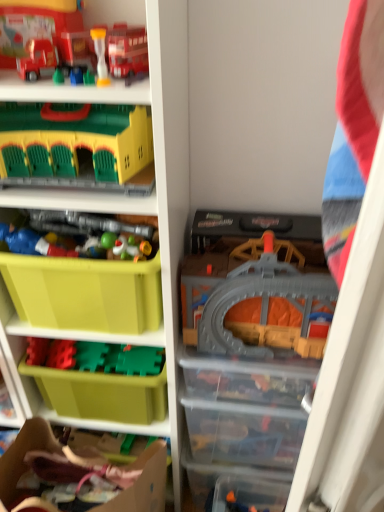
Question: Considering the relative sizes of matte plastic toy at left, placed as the 5th toy when sorted from top to bottom, and plastic toy soldiers at center, the fourth toy ordered from the bottom, in the image provided, is matte plastic toy at left, placed as the 5th toy when sorted from top to bottom, thinner than plastic toy soldiers at center, the fourth toy ordered from the bottom,?

Choices:
 (A) yes
 (B) no

Answer: (A)

Question: Is matte plastic toy at left, placed as the 5th toy when sorted from top to bottom, to the right of plastic toy soldiers at center, the fourth toy ordered from the bottom, from the viewer's perspective?

Choices:
 (A) yes
 (B) no

Answer: (B)

Question: Are matte plastic toy at left, the third toy ordered from the bottom, and plastic toy soldiers at center, the fourth toy ordered from the bottom, located far from each other?

Choices:
 (A) no
 (B) yes

Answer: (A)

Question: Is matte plastic toy at left, placed as the 5th toy when sorted from top to bottom, looking in the opposite direction of plastic toy soldiers at center, acting as the fourth toy starting from the top?

Choices:
 (A) no
 (B) yes

Answer: (B)

Question: Could you tell me if matte plastic toy at left, the third toy ordered from the bottom, is turned towards plastic toy soldiers at center, the fourth toy ordered from the bottom?

Choices:
 (A) yes
 (B) no

Answer: (B)

Question: Can you confirm if matte plastic toy at left, the third toy ordered from the bottom, is smaller than plastic toy soldiers at center, acting as the fourth toy starting from the top?

Choices:
 (A) yes
 (B) no

Answer: (A)

Question: Is matte plastic shelf at center not within green plastic building block at upper left, the fifth toy in the bottom-to-top sequence?

Choices:
 (A) yes
 (B) no

Answer: (A)

Question: Is green plastic building block at upper left, the fifth toy in the bottom-to-top sequence, a part of matte plastic shelf at center?

Choices:
 (A) yes
 (B) no

Answer: (A)

Question: Is matte plastic shelf at center in front of green plastic building block at upper left, which appears as the third toy when viewed from the top?

Choices:
 (A) yes
 (B) no

Answer: (A)

Question: From the image's perspective, is matte plastic shelf at center located beneath green plastic building block at upper left, the fifth toy in the bottom-to-top sequence?

Choices:
 (A) no
 (B) yes

Answer: (B)

Question: Is the depth of matte plastic shelf at center greater than that of green plastic building block at upper left, which appears as the third toy when viewed from the top?

Choices:
 (A) no
 (B) yes

Answer: (A)

Question: From the image's perspective, does matte plastic shelf at center appear higher than green plastic building block at upper left, which appears as the third toy when viewed from the top?

Choices:
 (A) yes
 (B) no

Answer: (B)

Question: Is plastic toy soldiers at center, the fourth toy ordered from the bottom, taller than matte plastic toy at left, placed as the 5th toy when sorted from top to bottom?

Choices:
 (A) no
 (B) yes

Answer: (B)